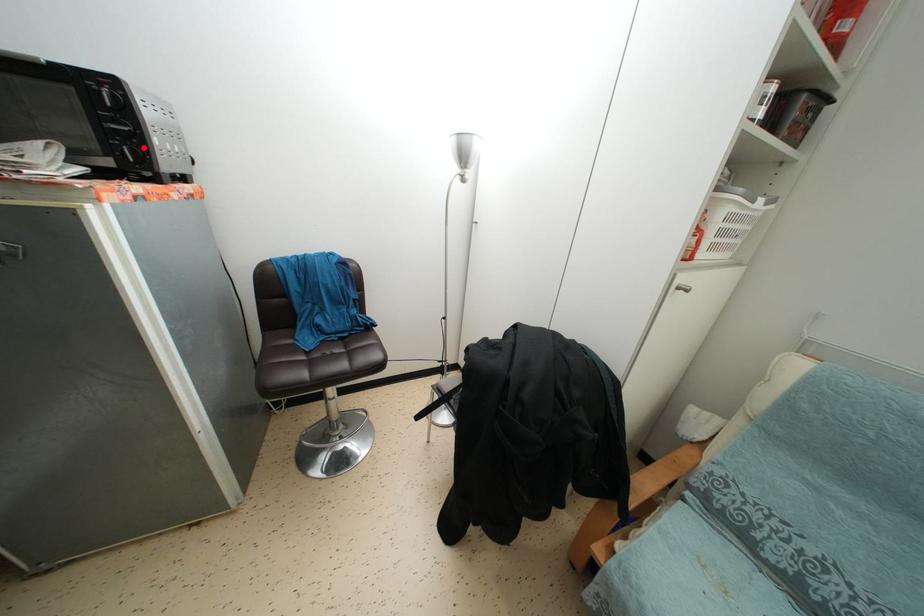
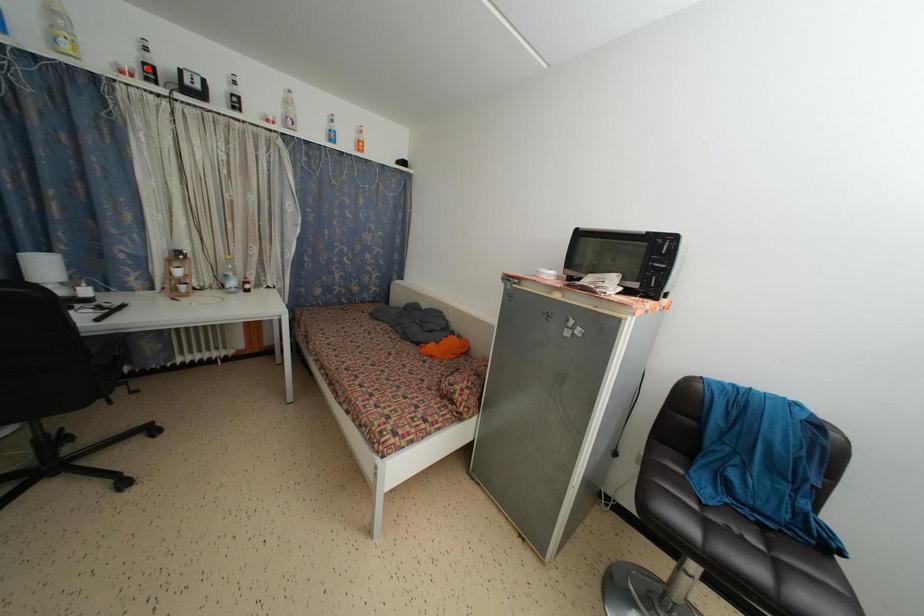
I am providing you with two images of the same scene from different viewpoints. A red point is marked on the first image and another point is marked on the second image. Do the highlighted points in image1 and image2 indicate the same real-world spot?

No